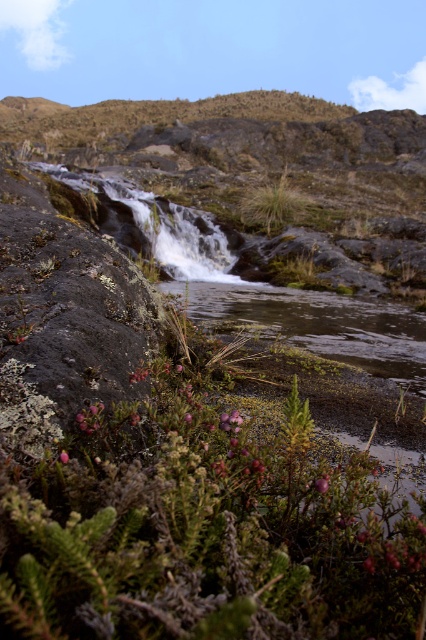
Question: Which of these objects is positioned farthest from the pink matte flower at center?

Choices:
 (A) green grass at center
 (B) pink matte flower at lower left
 (C) purple fuzzy berries at bottom center

Answer: (A)

Question: Which object is the closest to the pink matte flower at center?

Choices:
 (A) purple fuzzy berries at bottom center
 (B) pink matte flower at lower left
 (C) green grass at center

Answer: (A)

Question: Considering the relative positions of purple fuzzy berries at bottom center and green grass at center in the image provided, where is purple fuzzy berries at bottom center located with respect to green grass at center?

Choices:
 (A) below
 (B) above

Answer: (A)

Question: Considering the relative positions of green grass at center and pink matte flower at center in the image provided, where is green grass at center located with respect to pink matte flower at center?

Choices:
 (A) right
 (B) left

Answer: (A)

Question: Does purple fuzzy berries at bottom center appear over green grass at center?

Choices:
 (A) no
 (B) yes

Answer: (A)

Question: Which point is farther to the camera?

Choices:
 (A) click(328, 486)
 (B) click(65, 454)

Answer: (B)